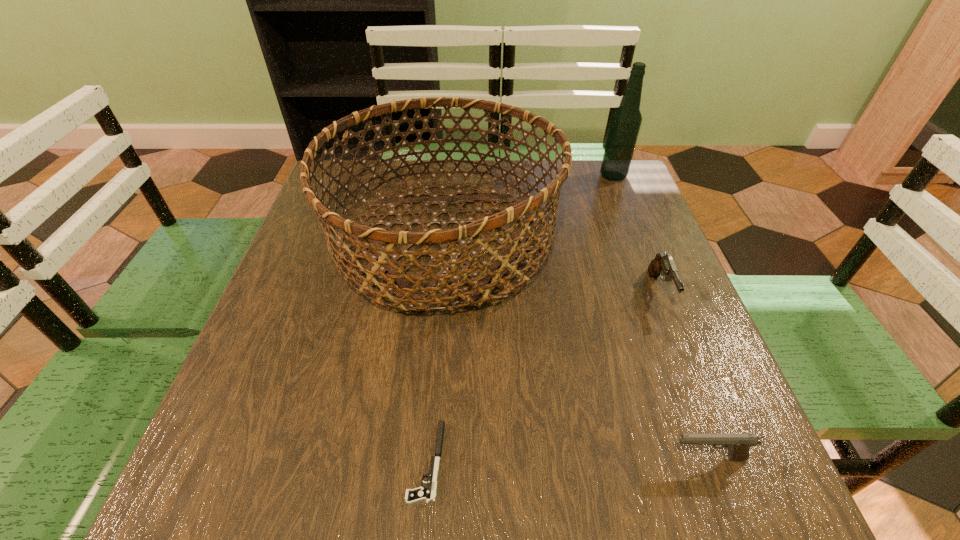
This screenshot has height=540, width=960. What are the coordinates of `free space located at the barrel of the second shortest object` in the screenshot? It's located at (624, 458).

The width and height of the screenshot is (960, 540). In order to click on free space located at the barrel of the second shortest object in this screenshot , I will do (572, 458).

Find the location of a particular element. The height and width of the screenshot is (540, 960). free space located 0.140m on the front-facing side of the leftmost pistol is located at coordinates (320, 461).

At what (x,y) coordinates should I click in order to perform the action: click on free space located 0.190m on the front-facing side of the leftmost pistol. Please return your answer as a coordinate pair (x, y). The image size is (960, 540). Looking at the image, I should click on (288, 461).

Image resolution: width=960 pixels, height=540 pixels. Find the location of `vacant space located 0.220m on the front-facing side of the leftmost pistol`. vacant space located 0.220m on the front-facing side of the leftmost pistol is located at coordinates (268, 461).

Where is `alcohol that is at the far edge`? The image size is (960, 540). alcohol that is at the far edge is located at coordinates (626, 120).

The image size is (960, 540). What are the coordinates of `basket at the far edge` in the screenshot? It's located at (411, 291).

Locate an element on the screen. The height and width of the screenshot is (540, 960). object present at the left edge is located at coordinates (411, 291).

Identify the location of alcohol present at the right edge. This screenshot has height=540, width=960. (626, 120).

Locate an element on the screen. Image resolution: width=960 pixels, height=540 pixels. object at the far left corner is located at coordinates (411, 291).